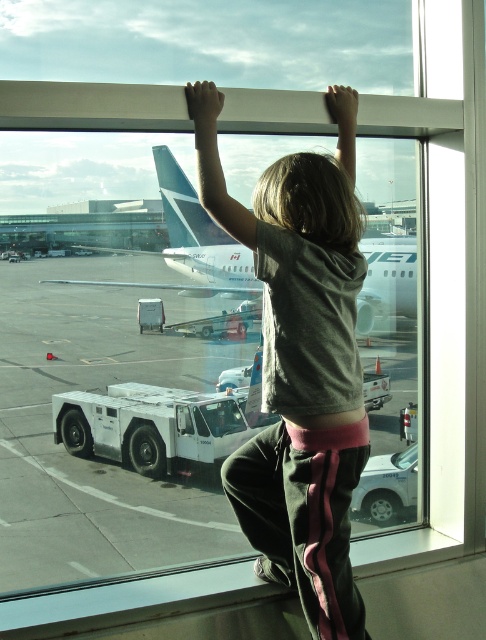
Can you confirm if gray cotton shirt at upper center is bigger than white matte airplane at center?

No.

Based on the photo, can you confirm if gray cotton shirt at upper center is shorter than white matte airplane at center?

Yes.

Identify the location of gray cotton shirt at upper center. The image size is (486, 640). (299, 364).

At what (x,y) coordinates should I click in order to perform the action: click on gray cotton shirt at upper center. Please return your answer as a coordinate pair (x, y). Looking at the image, I should click on (299, 364).